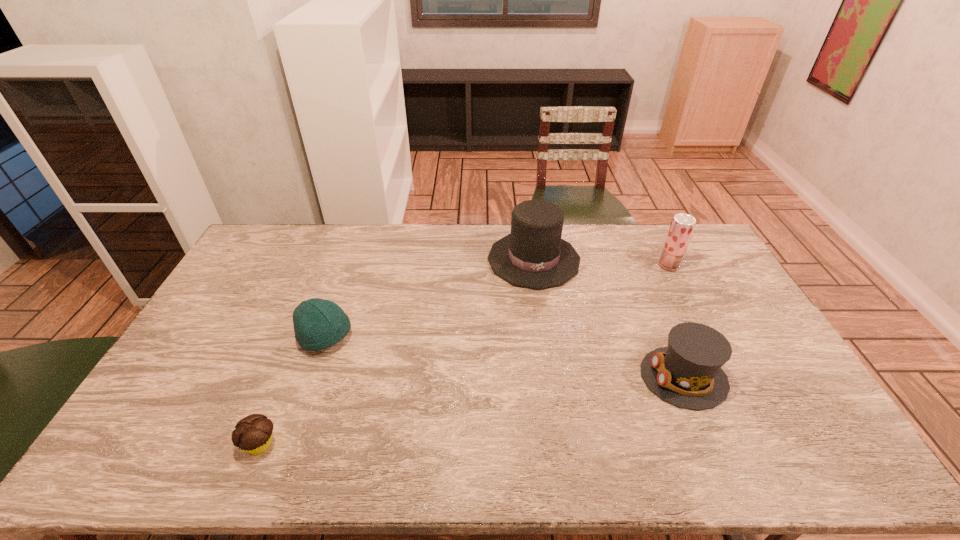
In order to click on free space that is in between the farther dress hat and the nearest object in this screenshot , I will do `click(397, 352)`.

The image size is (960, 540). I want to click on free space that is in between the muffin and the fruit juice, so click(x=465, y=355).

Find the location of a particular element. The image size is (960, 540). unoccupied position between the taller dress hat and the fourth tallest object is located at coordinates (x=430, y=298).

This screenshot has height=540, width=960. I want to click on vacant region between the fruit juice and the left dress hat, so click(601, 262).

Identify the location of free space between the fruit juice and the beanie. The height and width of the screenshot is (540, 960). (497, 301).

Find the location of a particular element. object that is the second closest one to the right dress hat is located at coordinates (682, 226).

The width and height of the screenshot is (960, 540). Find the location of `object that can be found as the closest to the muffin`. object that can be found as the closest to the muffin is located at coordinates (318, 324).

The image size is (960, 540). Identify the location of free region that satisfies the following two spatial constraints: 1. on the back side of the fourth tallest object; 2. on the left side of the fruit juice. (350, 265).